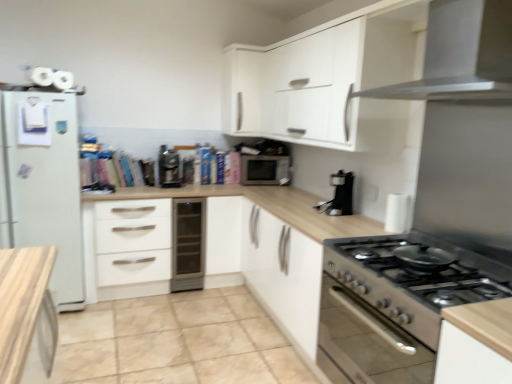
Question: Considering the relative sizes of satin silver range hood at upper right, the 2th kitchen appliance ordered from the bottom, and satin black coffee machine at center, marked as the first coffee machine in a left-to-right arrangement, in the image provided, is satin silver range hood at upper right, the 2th kitchen appliance ordered from the bottom, smaller than satin black coffee machine at center, marked as the first coffee machine in a left-to-right arrangement,?

Choices:
 (A) no
 (B) yes

Answer: (A)

Question: Is satin silver range hood at upper right, the 2th kitchen appliance ordered from the bottom, not near satin black coffee machine at center, which appears as the second coffee machine when viewed from the right?

Choices:
 (A) no
 (B) yes

Answer: (B)

Question: From a real-world perspective, is satin silver range hood at upper right, the 2th kitchen appliance ordered from the bottom, physically below satin black coffee machine at center, which appears as the second coffee machine when viewed from the right?

Choices:
 (A) yes
 (B) no

Answer: (B)

Question: From a real-world perspective, is satin silver range hood at upper right, arranged as the 1th kitchen appliance when viewed from the top, on satin black coffee machine at center, the 1th coffee machine viewed from the back?

Choices:
 (A) yes
 (B) no

Answer: (A)

Question: Is satin silver range hood at upper right, arranged as the 1th kitchen appliance when viewed from the top, bigger than satin black coffee machine at center, the second coffee machine in the front-to-back sequence?

Choices:
 (A) yes
 (B) no

Answer: (A)

Question: Does satin silver range hood at upper right, the 2th kitchen appliance ordered from the bottom, come behind satin black coffee machine at center, which appears as the second coffee machine when viewed from the right?

Choices:
 (A) no
 (B) yes

Answer: (A)

Question: From a real-world perspective, is white matte drawer at center below satin silver dishwasher at center?

Choices:
 (A) no
 (B) yes

Answer: (A)

Question: From the image's perspective, is white matte drawer at center located beneath satin silver dishwasher at center?

Choices:
 (A) no
 (B) yes

Answer: (A)

Question: Considering the relative positions of white matte drawer at center and satin silver dishwasher at center in the image provided, is white matte drawer at center to the left of satin silver dishwasher at center from the viewer's perspective?

Choices:
 (A) no
 (B) yes

Answer: (B)

Question: Is white matte drawer at center shorter than satin silver dishwasher at center?

Choices:
 (A) no
 (B) yes

Answer: (A)

Question: Is there a large distance between white matte drawer at center and satin silver dishwasher at center?

Choices:
 (A) yes
 (B) no

Answer: (B)

Question: Is satin silver dishwasher at center located within white matte drawer at center?

Choices:
 (A) yes
 (B) no

Answer: (B)

Question: Is satin silver dishwasher at center outside of satin black coffee machine at center, the second coffee machine in the front-to-back sequence?

Choices:
 (A) yes
 (B) no

Answer: (A)